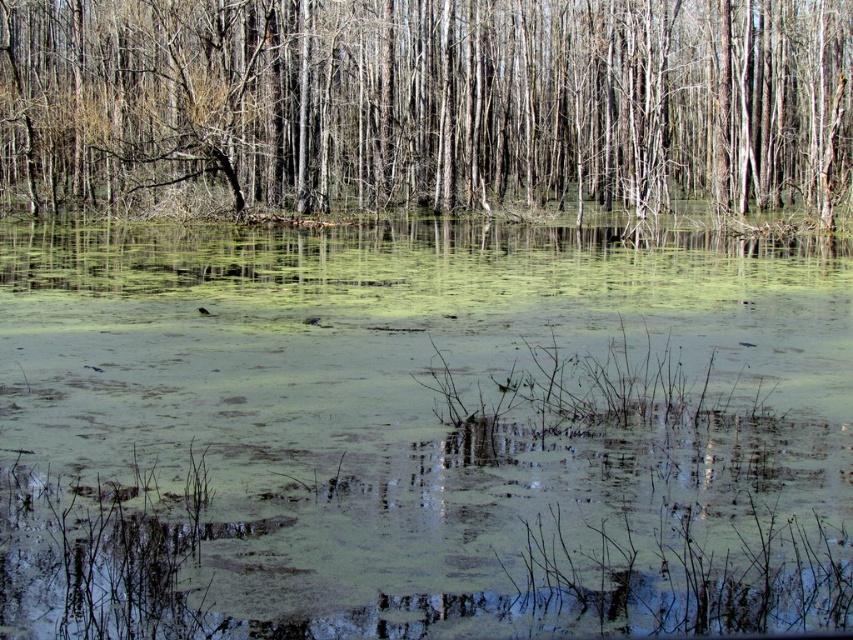
Who is shorter, green algae water at center or smooth bark tree at center?

green algae water at center is shorter.

Identify the location of green algae water at center. This screenshot has height=640, width=853. (421, 432).